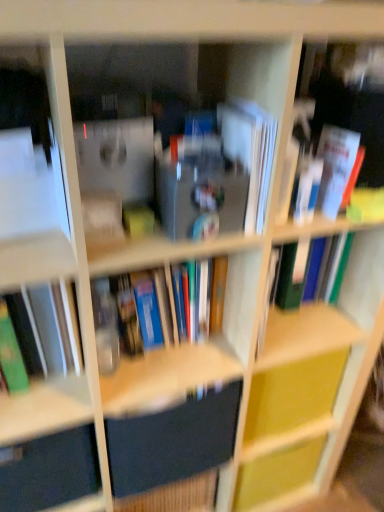
Question: Does matte black drawer at lower left lie in front of white paper at center, arranged as the 2th paperback book when ordered from the bottom?

Choices:
 (A) no
 (B) yes

Answer: (A)

Question: From a real-world perspective, is matte black drawer at lower left under white paper at center, marked as the first paperback book in a top-to-bottom arrangement?

Choices:
 (A) yes
 (B) no

Answer: (A)

Question: Could white paper at center, arranged as the 2th paperback book when ordered from the bottom, be considered to be inside matte black drawer at lower left?

Choices:
 (A) no
 (B) yes

Answer: (A)

Question: Does matte black drawer at lower left lie behind white paper at center, arranged as the 2th paperback book when ordered from the bottom?

Choices:
 (A) yes
 (B) no

Answer: (A)

Question: From the image's perspective, does matte black drawer at lower left appear lower than white paper at center, marked as the first paperback book in a top-to-bottom arrangement?

Choices:
 (A) no
 (B) yes

Answer: (B)

Question: Is hardcover book at center, which ranks as the 3th book in right-to-left order, in front of or behind green matte book at left, which ranks as the 4th book in right-to-left order, in the image?

Choices:
 (A) behind
 (B) front

Answer: (A)

Question: Choose the correct answer: Is hardcover book at center, the second book in the left-to-right sequence, inside green matte book at left, acting as the 1th book starting from the left, or outside it?

Choices:
 (A) inside
 (B) outside

Answer: (B)

Question: From a real-world perspective, is hardcover book at center, the second book in the left-to-right sequence, positioned above or below green matte book at left, acting as the 1th book starting from the left?

Choices:
 (A) above
 (B) below

Answer: (B)

Question: Does point (206, 292) appear closer or farther from the camera than point (46, 285)?

Choices:
 (A) closer
 (B) farther

Answer: (B)

Question: Visually, is hardcover book at center, the second book in the left-to-right sequence, positioned to the left or to the right of yellow matte cabinet at center?

Choices:
 (A) left
 (B) right

Answer: (A)

Question: Relative to yellow matte cabinet at center, is hardcover book at center, the second book in the left-to-right sequence, in front or behind?

Choices:
 (A) front
 (B) behind

Answer: (A)

Question: In terms of width, does hardcover book at center, which ranks as the 3th book in right-to-left order, look wider or thinner when compared to yellow matte cabinet at center?

Choices:
 (A) wide
 (B) thin

Answer: (A)

Question: From the image's perspective, is hardcover book at center, the second book in the left-to-right sequence, above or below yellow matte cabinet at center?

Choices:
 (A) below
 (B) above

Answer: (B)

Question: Is white paper book at right, which appears as the 2th book when viewed from the right, to the left or to the right of green matte book at left, which ranks as the 4th book in right-to-left order, in the image?

Choices:
 (A) right
 (B) left

Answer: (A)

Question: From the image's perspective, is white paper book at right, which appears as the 2th book when viewed from the right, positioned above or below green matte book at left, which ranks as the 4th book in right-to-left order?

Choices:
 (A) above
 (B) below

Answer: (A)